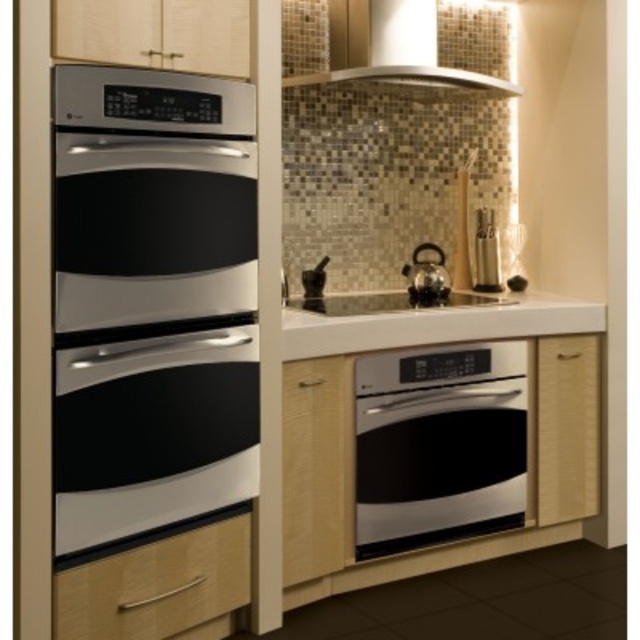
Who is more distant from viewer, (60, 518) or (515, 307)?

Point (515, 307)

Is matte black oven at left to the right of white glossy countertop at center from the viewer's perspective?

Incorrect, matte black oven at left is not on the right side of white glossy countertop at center.

The height and width of the screenshot is (640, 640). Describe the element at coordinates (152, 433) in the screenshot. I see `matte black oven at left` at that location.

Identify the location of matte black oven at left. The width and height of the screenshot is (640, 640). (152, 433).

This screenshot has height=640, width=640. I want to click on satin stainless steel oven at center, so click(438, 444).

Does satin stainless steel oven at center appear under white glossy countertop at center?

Correct, satin stainless steel oven at center is located below white glossy countertop at center.

This screenshot has width=640, height=640. What do you see at coordinates (438, 444) in the screenshot?
I see `satin stainless steel oven at center` at bounding box center [438, 444].

The image size is (640, 640). Identify the location of satin stainless steel oven at center. (438, 444).

Can you confirm if satin stainless steel oven at center is wider than wooden drawer at lower left?

Yes.

Does satin stainless steel oven at center appear on the right side of wooden drawer at lower left?

Indeed, satin stainless steel oven at center is positioned on the right side of wooden drawer at lower left.

What do you see at coordinates (438, 444) in the screenshot?
I see `satin stainless steel oven at center` at bounding box center [438, 444].

What are the coordinates of `satin stainless steel oven at center` in the screenshot? It's located at (438, 444).